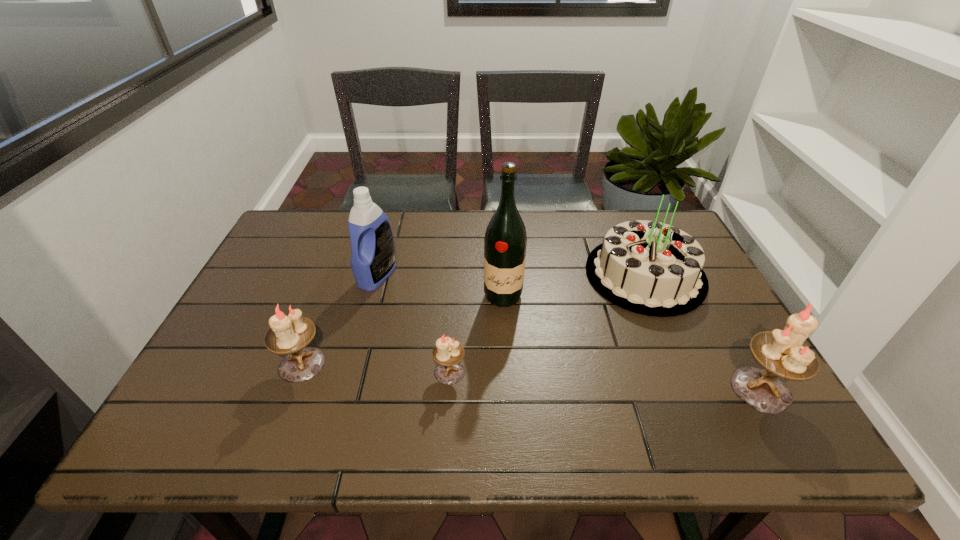
Find the location of a particular element. The height and width of the screenshot is (540, 960). blank space at the far edge of the desktop is located at coordinates (438, 233).

Locate an element on the screen. The image size is (960, 540). blank space at the near edge of the desktop is located at coordinates (437, 404).

Locate an element on the screen. Image resolution: width=960 pixels, height=540 pixels. vacant space at the left edge is located at coordinates (284, 260).

This screenshot has height=540, width=960. I want to click on free space at the right edge of the desktop, so click(x=692, y=330).

This screenshot has height=540, width=960. In the image, there is a desktop. Identify the location of vacant space at the far left corner. (285, 232).

Locate an element on the screen. This screenshot has height=540, width=960. free spot between the leftmost candle holder and the second object from left to right is located at coordinates pyautogui.click(x=340, y=320).

This screenshot has width=960, height=540. I want to click on vacant area that lies between the birthday cake and the second shortest candle holder, so click(x=473, y=319).

Where is `free space between the leftmost candle holder and the fourth object from left to right`? Image resolution: width=960 pixels, height=540 pixels. free space between the leftmost candle holder and the fourth object from left to right is located at coordinates (402, 330).

In order to click on vacant point located between the second candle holder from right to left and the leftmost object in this screenshot , I will do `click(375, 368)`.

Locate an element on the screen. free spot between the fifth object from right to left and the shortest object is located at coordinates (414, 324).